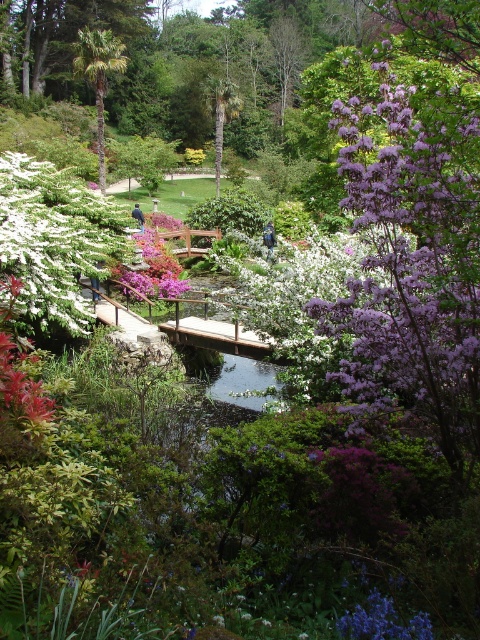
Question: Is white matte flowers at left smaller than wooden bridge at center?

Choices:
 (A) no
 (B) yes

Answer: (A)

Question: Can you confirm if white matte flowers at left is smaller than wooden bridge at center?

Choices:
 (A) no
 (B) yes

Answer: (A)

Question: Which point is farther from the camera taking this photo?

Choices:
 (A) (211, 84)
 (B) (255, 358)
 (C) (391, 608)

Answer: (A)

Question: Based on their relative distances, which object is nearer to the pink matte flower at center?

Choices:
 (A) purple silky flower at upper right
 (B) green leafy bush at center

Answer: (A)

Question: Among these points, which one is nearest to the camera?

Choices:
 (A) (151, 236)
 (B) (100, 180)
 (C) (388, 604)

Answer: (C)

Question: Is wooden bridge at center further to the viewer compared to pink matte flower at center?

Choices:
 (A) yes
 (B) no

Answer: (B)